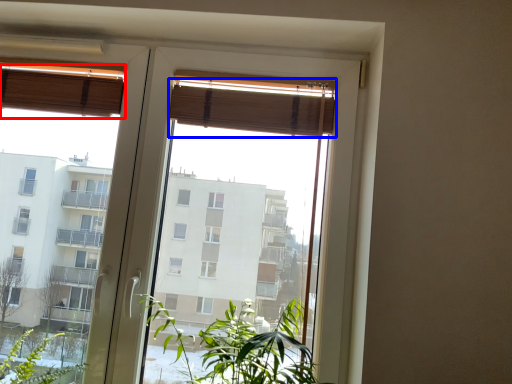
Question: Which object is closer to the camera taking this photo, curtain (highlighted by a red box) or curtain (highlighted by a blue box)?

Choices:
 (A) curtain
 (B) curtain

Answer: (B)